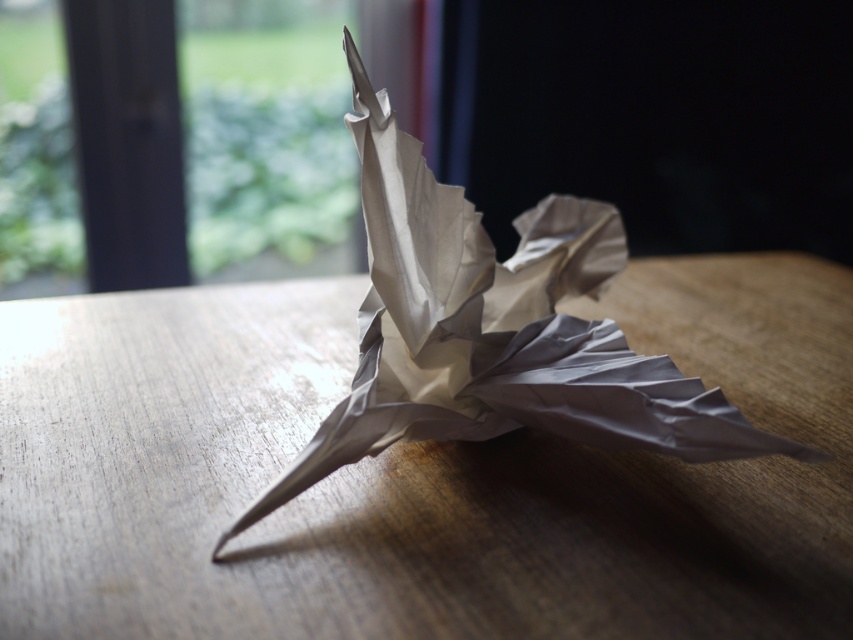
You are an artist who wants to place a small sculpture on the wooden table at center. The sculpture is 15 cm in height. Can the matte paper bird at center currently on the table accommodate the sculpture without overlapping?

The wooden table at center is larger in size than the matte paper bird at center, so there should be enough space to place the sculpture without overlapping.

You are standing in front of an origami bird displayed on a wooden surface. You want to take a photo of the bird from a distance of exactly 3.84 feet. Where should you position yourself relative to the point labeled as point (x=309, y=429)?

You should position yourself exactly at the point labeled as point (x=309, y=429) because the distance from that point to the camera is 3.84 feet, which matches the desired distance for taking the photo.